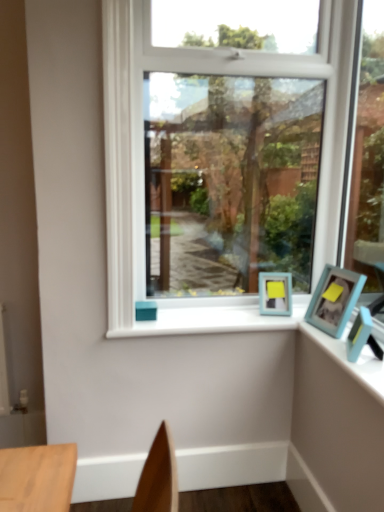
The image size is (384, 512). What do you see at coordinates (202, 317) in the screenshot? I see `white painted wood at center` at bounding box center [202, 317].

Locate an element on the screen. blue plastic photo frame at upper right is located at coordinates (351, 362).

The height and width of the screenshot is (512, 384). Find the location of `teal matte picture frame at right, the first picture frame viewed from the front`. teal matte picture frame at right, the first picture frame viewed from the front is located at coordinates 359,334.

From the picture: Measure the distance between point (305, 297) and camera.

Point (305, 297) and camera are 6.71 feet apart from each other.

You are a GUI agent. You are given a task and a screenshot of the screen. Output one action in this format:
    pyautogui.click(x=<x>, y=<y>)
    Task: Click on the white painted wood at center
    This screenshot has width=384, height=512.
    Given the screenshot: What is the action you would take?
    pyautogui.click(x=202, y=317)

In terms of width, does light blue plastic picture frame at right, which is the second picture frame from front to back, look wider or thinner when compared to teal matte picture frame at right, the first picture frame viewed from the front?

light blue plastic picture frame at right, which is the second picture frame from front to back, is thinner than teal matte picture frame at right, the first picture frame viewed from the front.

Would you say light blue plastic picture frame at right, which is the 1th picture frame from back to front, is a long distance from teal matte picture frame at right, the first picture frame viewed from the front?

They are positioned close to each other.

Considering the relative positions of light blue plastic picture frame at right, which is the second picture frame from front to back, and teal matte picture frame at right, which is the second picture frame in back-to-front order, in the image provided, is light blue plastic picture frame at right, which is the second picture frame from front to back, to the right of teal matte picture frame at right, which is the second picture frame in back-to-front order, from the viewer's perspective?

No.

Relative to teal matte picture frame at right, which is the second picture frame in back-to-front order, is light blue plastic picture frame at right, which is the second picture frame from front to back, in front or behind?

Clearly, light blue plastic picture frame at right, which is the second picture frame from front to back, is behind teal matte picture frame at right, which is the second picture frame in back-to-front order.

Relative to white painted wood at center, is blue plastic photo frame at upper right in front or behind?

blue plastic photo frame at upper right is in front of white painted wood at center.

What's the angular difference between blue plastic photo frame at upper right and white painted wood at center's facing directions?

89.4 degrees.

Consider the image. Which is more distant, (355,376) or (156,326)?

The point (156,326) is farther.

Between clear glass window at center and blue plastic photo frame at upper right, which one appears on the left side from the viewer's perspective?

clear glass window at center.

From a real-world perspective, is clear glass window at center positioned under blue plastic photo frame at upper right based on gravity?

Actually, clear glass window at center is physically above blue plastic photo frame at upper right in the real world.

Is clear glass window at center oriented away from blue plastic photo frame at upper right?

clear glass window at center is not turned away from blue plastic photo frame at upper right.

Between white painted wood at center and blue plastic photo frame at upper right, which one has larger size?

Bigger between the two is white painted wood at center.

Between white painted wood at center and blue plastic photo frame at upper right, which one has more height?

white painted wood at center.

Considering the points (232, 310) and (364, 368), which point is in front, point (232, 310) or point (364, 368)?

Positioned in front is point (364, 368).

Is teal matte picture frame at right, which is the second picture frame in back-to-front order, next to white painted wood at center?

teal matte picture frame at right, which is the second picture frame in back-to-front order, is not next to white painted wood at center, and they're not touching.

Considering the sizes of objects teal matte picture frame at right, the first picture frame viewed from the front, and white painted wood at center in the image provided, who is thinner, teal matte picture frame at right, the first picture frame viewed from the front, or white painted wood at center?

Thinner between the two is teal matte picture frame at right, the first picture frame viewed from the front.

Is teal matte picture frame at right, the first picture frame viewed from the front, to the left or to the right of white painted wood at center in the image?

teal matte picture frame at right, the first picture frame viewed from the front, is positioned on white painted wood at center's right side.

Does teal matte picture frame at right, the first picture frame viewed from the front, turn towards white painted wood at center?

Yes.

At what (x,y) coordinates should I click in order to perform the action: click on window sill located below the clear glass window at center (from the image's perspective). Please return your answer as a coordinate pair (x, y). This screenshot has width=384, height=512. Looking at the image, I should click on point(202,317).

Between point (136, 249) and point (180, 321), which one is positioned in front?

The point (180, 321) is closer.

Is clear glass window at center oriented towards white painted wood at center?

Yes, clear glass window at center is oriented towards white painted wood at center.

Is the surface of light blue plastic picture frame at right, which is the 1th picture frame from back to front, in direct contact with white painted wood at center?

No, light blue plastic picture frame at right, which is the 1th picture frame from back to front, is not beside white painted wood at center.

Which is correct: light blue plastic picture frame at right, which is the 1th picture frame from back to front, is inside white painted wood at center, or outside of it?

light blue plastic picture frame at right, which is the 1th picture frame from back to front, is outside white painted wood at center.

Is the position of light blue plastic picture frame at right, which is the 1th picture frame from back to front, more distant than that of white painted wood at center?

That is False.

You are a GUI agent. You are given a task and a screenshot of the screen. Output one action in this format:
    pyautogui.click(x=<x>, y=<y>)
    Task: Click on the picture frame below the light blue plastic picture frame at right, which is the 1th picture frame from back to front (from a real-world perspective)
    Image resolution: width=384 pixels, height=512 pixels.
    Given the screenshot: What is the action you would take?
    pyautogui.click(x=359, y=334)

The height and width of the screenshot is (512, 384). Find the location of `window sill behind the blue plastic photo frame at upper right`. window sill behind the blue plastic photo frame at upper right is located at coordinates (202, 317).

From the image, which object appears to be nearer to clear glass window at center, blue plastic photo frame at upper right or teal matte picture frame at right, which is the second picture frame in back-to-front order?

blue plastic photo frame at upper right is closer to clear glass window at center.

Considering their positions, is clear glass window at center positioned closer to teal matte picture frame at right, which is the second picture frame in back-to-front order, than light blue plastic picture frame at right, which is the 1th picture frame from back to front?

Among the two, light blue plastic picture frame at right, which is the 1th picture frame from back to front, is located nearer to teal matte picture frame at right, which is the second picture frame in back-to-front order.

Estimate the real-world distances between objects in this image. Which object is closer to white painted wood at center, light blue plastic picture frame at right, which is the 1th picture frame from back to front, or teal matte picture frame at right, which is the second picture frame in back-to-front order?

The object closer to white painted wood at center is light blue plastic picture frame at right, which is the 1th picture frame from back to front.

When comparing their distances from clear glass window at center, does teal matte picture frame at right, which is the second picture frame in back-to-front order, or light blue plastic picture frame at right, which is the 1th picture frame from back to front, seem further?

teal matte picture frame at right, which is the second picture frame in back-to-front order, is further to clear glass window at center.

Considering their positions, is white painted wood at center positioned closer to clear glass window at center than blue plastic photo frame at upper right?

The object closer to clear glass window at center is white painted wood at center.

Looking at the image, which one is located closer to light blue plastic picture frame at right, which is the second picture frame from front to back, teal matte picture frame at right, the first picture frame viewed from the front, or blue plastic photo frame at upper right?

blue plastic photo frame at upper right is closer to light blue plastic picture frame at right, which is the second picture frame from front to back.

Looking at the image, which one is located closer to blue plastic photo frame at upper right, teal matte picture frame at right, the first picture frame viewed from the front, or light blue plastic picture frame at right, which is the 1th picture frame from back to front?

teal matte picture frame at right, the first picture frame viewed from the front, is positioned closer to the anchor blue plastic photo frame at upper right.

Considering their positions, is white painted wood at center positioned further to blue plastic photo frame at upper right than teal matte picture frame at right, the first picture frame viewed from the front?

Based on the image, white painted wood at center appears to be further to blue plastic photo frame at upper right.

Locate an element on the screen. Image resolution: width=384 pixels, height=512 pixels. picture frame between clear glass window at center and teal matte picture frame at right, which is the second picture frame in back-to-front order, in the up-down direction is located at coordinates (334, 298).

The height and width of the screenshot is (512, 384). I want to click on picture frame between white painted wood at center and blue plastic photo frame at upper right in the horizontal direction, so click(x=334, y=298).

This screenshot has height=512, width=384. I want to click on window sill that lies between clear glass window at center and blue plastic photo frame at upper right from top to bottom, so click(202, 317).

The height and width of the screenshot is (512, 384). Identify the location of picture frame positioned between blue plastic photo frame at upper right and light blue plastic picture frame at right, which is the 1th picture frame from back to front, from near to far. (359, 334).